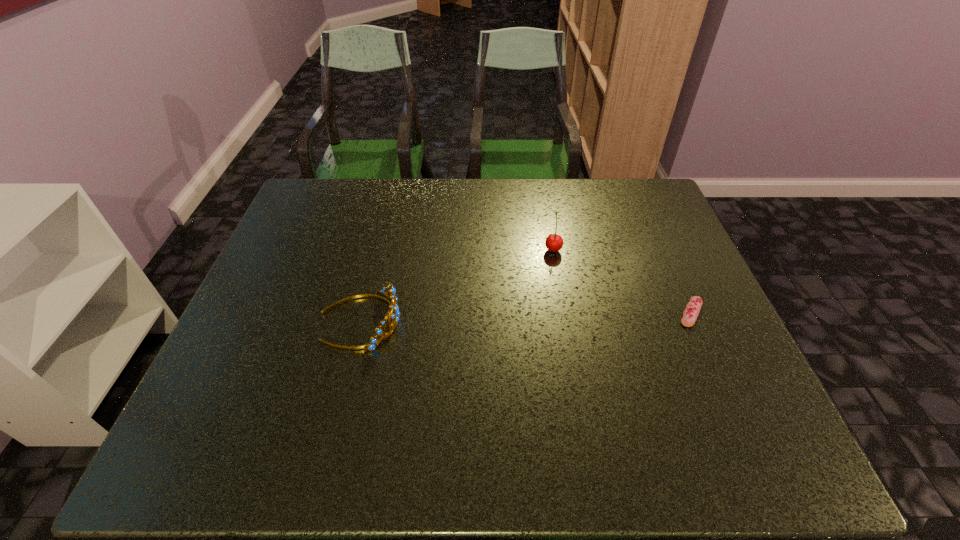
Where is `tiara`? tiara is located at coordinates (393, 312).

You are a GUI agent. You are given a task and a screenshot of the screen. Output one action in this format:
    pyautogui.click(x=<x>, y=<y>)
    Task: Click on the cherry
    
    Given the screenshot: What is the action you would take?
    pyautogui.click(x=554, y=242)

You are a GUI agent. You are given a task and a screenshot of the screen. Output one action in this format:
    pyautogui.click(x=<x>, y=<y>)
    Task: Click on the second object from left to right
    
    Given the screenshot: What is the action you would take?
    pyautogui.click(x=554, y=242)

Identify the location of the shortest object. This screenshot has width=960, height=540. (690, 314).

The image size is (960, 540). In order to click on eclair in this screenshot , I will do `click(690, 314)`.

Where is `vacant area situated on the front-facing side of the tiara`? The image size is (960, 540). vacant area situated on the front-facing side of the tiara is located at coordinates (523, 320).

At what (x,y) coordinates should I click in order to perform the action: click on free spot located on the front of the farthest object. Please return your answer as a coordinate pair (x, y). The image size is (960, 540). Looking at the image, I should click on pos(564,316).

Find the location of `vacant space located 0.190m on the left of the rightmost object`. vacant space located 0.190m on the left of the rightmost object is located at coordinates (600, 313).

Find the location of a particular element. object that is positioned at the right edge is located at coordinates (690, 314).

This screenshot has width=960, height=540. I want to click on vacant space at the far edge of the desktop, so click(x=417, y=186).